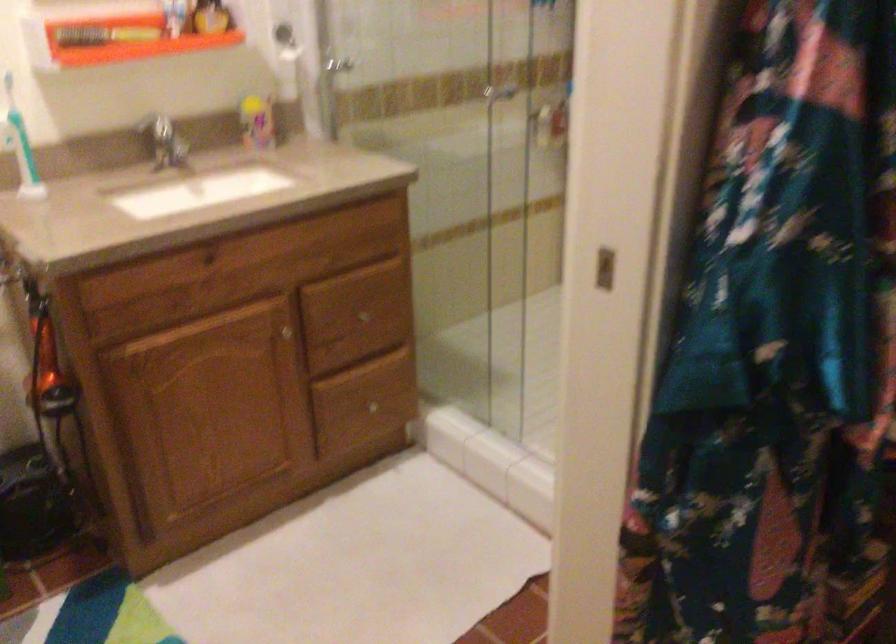
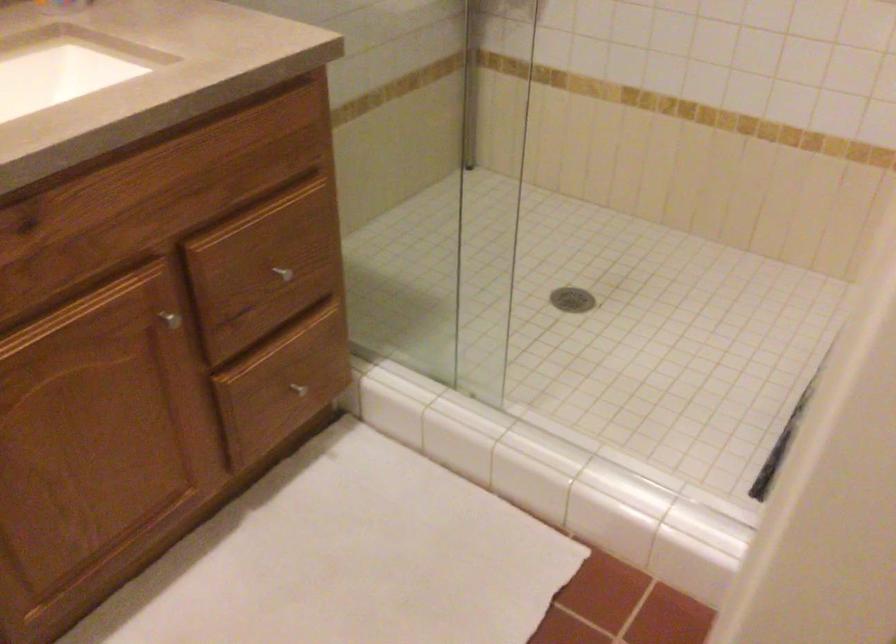
Locate, in the second image, the point that corresponds to the point at 280,335 in the first image.

(169, 319)